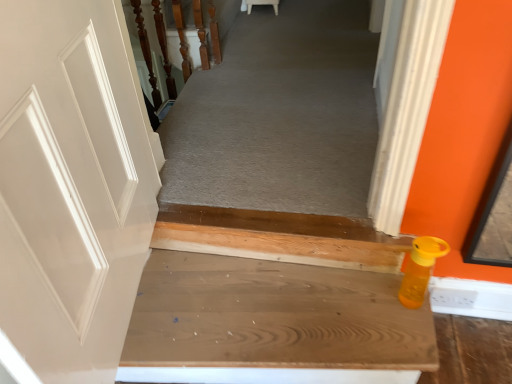
Find the location of a particular element. This screenshot has height=384, width=512. free point in front of orange matte bottle at lower right is located at coordinates (411, 337).